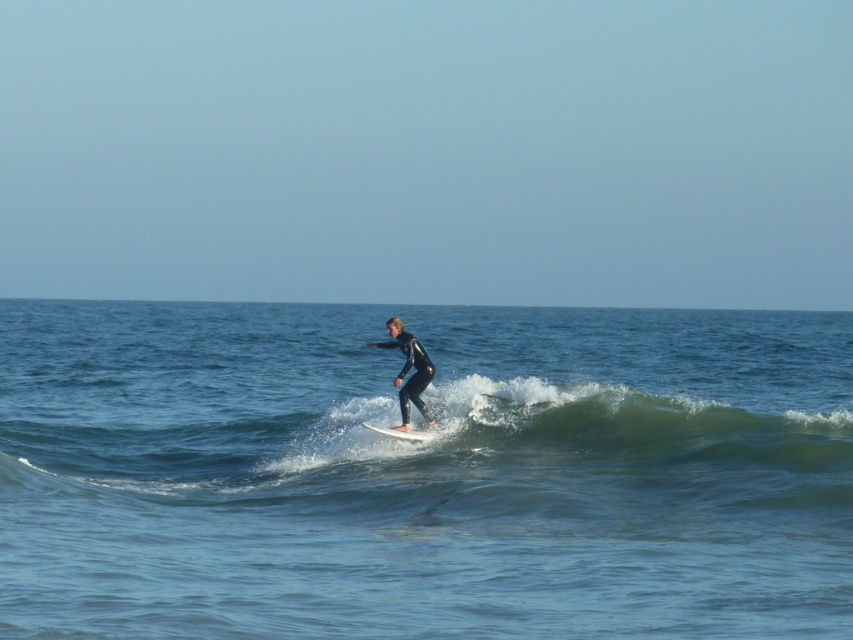
You are a photographer trying to capture the surfer in the image. You notice the clear blue water at wave center and the white smooth surfboard at center. Which object is positioned higher in the image?

The clear blue water at wave center is located above the white smooth surfboard at center, so it is positioned higher in the image.